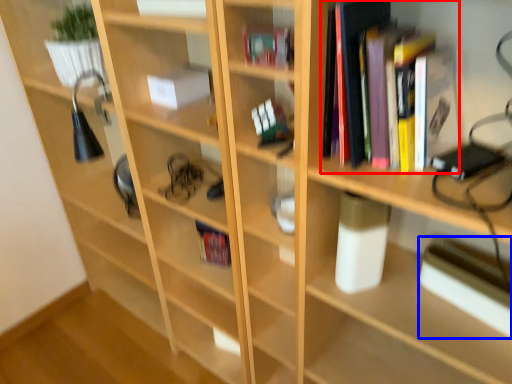
Question: Which of the following is the closest to the observer, book (highlighted by a red box) or paperback book (highlighted by a blue box)?

Choices:
 (A) book
 (B) paperback book

Answer: (A)